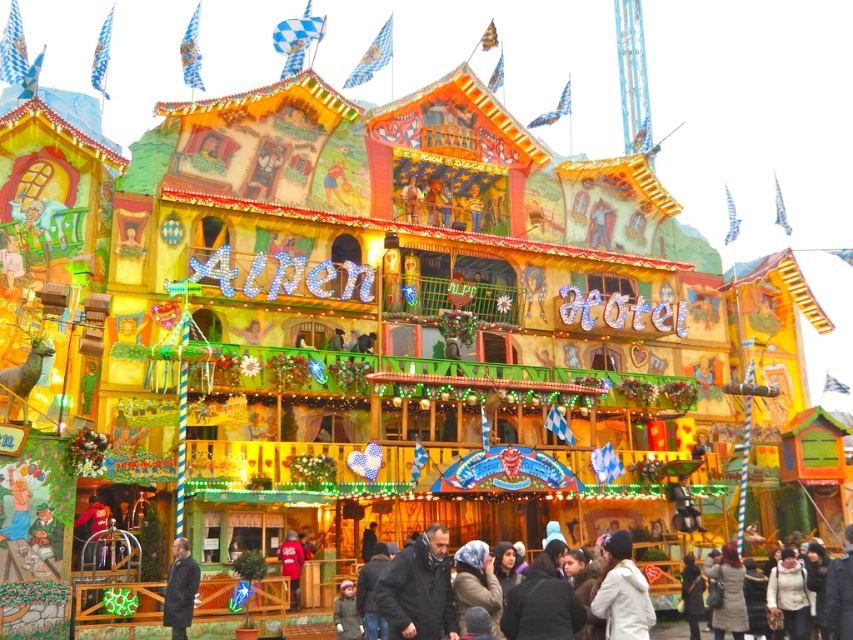
Can you confirm if black matte jacket at center is thinner than dark gray coat at lower left?

Incorrect, black matte jacket at center's width is not less than dark gray coat at lower left's.

Is black matte jacket at center to the right of dark gray coat at lower left from the viewer's perspective?

Indeed, black matte jacket at center is positioned on the right side of dark gray coat at lower left.

Is point (416, 611) positioned before point (177, 593)?

Yes, point (416, 611) is closer to viewer.

Locate an element on the screen. black matte jacket at center is located at coordinates (418, 589).